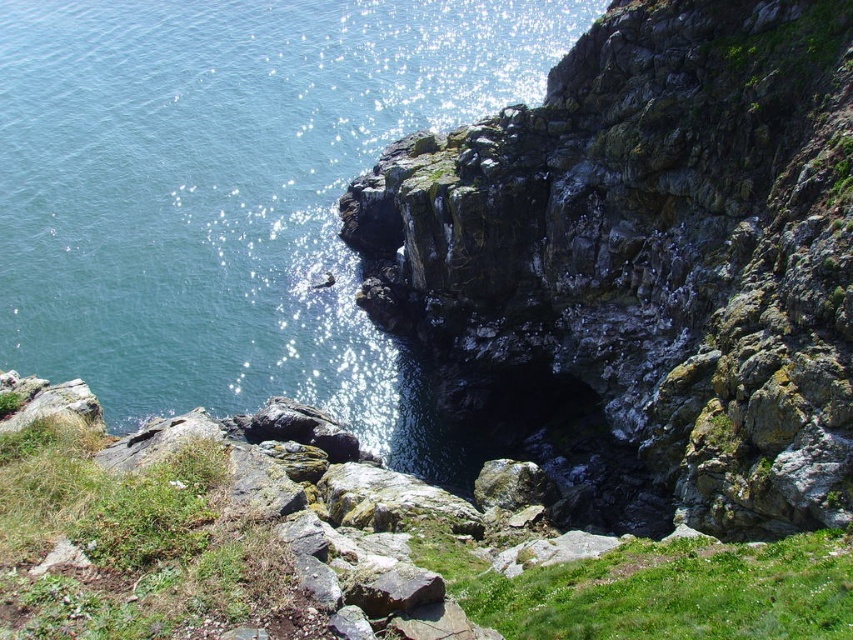
You are standing at the cliff edge on the rugged coastal landscape and see two points marked in the image. The first point is at coordinates point (830, 362) and the second is at point (283, 84). Which point is closer to you?

Point (830, 362) is in front of point (283, 84), so it is closer to you.